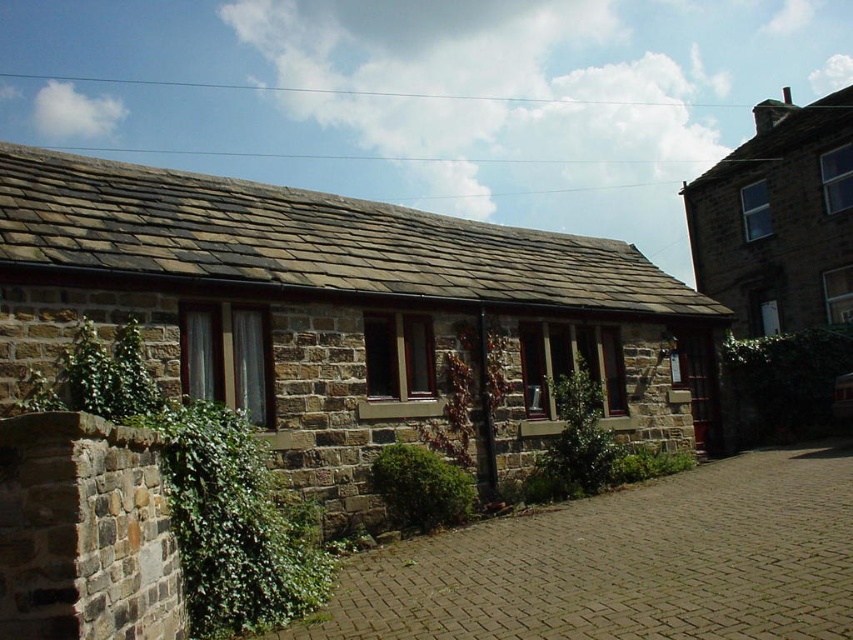
Is brown stone cottage at center smaller than green leafy ivy at left?

No.

Based on the photo, who is shorter, brown stone cottage at center or green leafy ivy at left?

With less height is green leafy ivy at left.

Describe the element at coordinates (346, 316) in the screenshot. I see `brown stone cottage at center` at that location.

The height and width of the screenshot is (640, 853). Identify the location of brown stone cottage at center. (346, 316).

Does brown stone cottage at center appear under brown stone cottage at upper right?

Yes.

Is brown stone cottage at center further to camera compared to brown stone cottage at upper right?

That is False.

Is point (289, 433) more distant than point (737, 227)?

That is False.

At what (x,y) coordinates should I click in order to perform the action: click on brown stone cottage at center. Please return your answer as a coordinate pair (x, y). Looking at the image, I should click on (346, 316).

Can you confirm if green leafy ivy at left is positioned above green leafy ivy at center?

Yes, green leafy ivy at left is above green leafy ivy at center.

From the picture: Can you confirm if green leafy ivy at left is thinner than green leafy ivy at center?

In fact, green leafy ivy at left might be wider than green leafy ivy at center.

What are the coordinates of `green leafy ivy at left` in the screenshot? It's located at (201, 488).

Locate an element on the screen. The width and height of the screenshot is (853, 640). green leafy ivy at left is located at coordinates (201, 488).